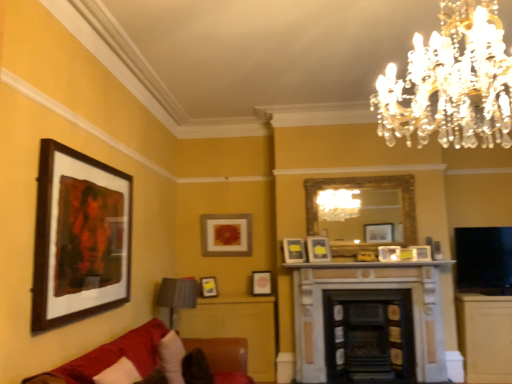
I want to click on free spot above matte gold picture frame at center, the third picture frame viewed from the left (from a real-world perspective), so click(x=232, y=206).